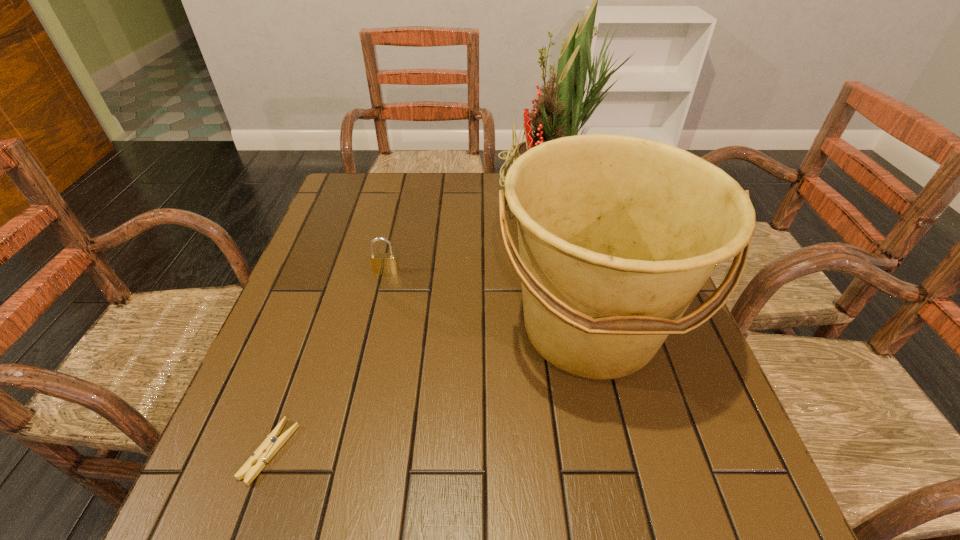
You are a GUI agent. You are given a task and a screenshot of the screen. Output one action in this format:
    pyautogui.click(x=<x>, y=<y>)
    Task: Click on the free region at the far edge of the desktop
    This screenshot has height=540, width=960.
    Given the screenshot: What is the action you would take?
    pyautogui.click(x=397, y=185)

Identify the location of vacant space at the near edge of the desktop. (616, 517).

Locate an element on the screen. vacant space at the left edge is located at coordinates (311, 349).

At what (x,y) coordinates should I click in order to perform the action: click on vacant space at the far left corner of the desktop. Please return your answer as a coordinate pair (x, y). Looking at the image, I should click on (360, 173).

The width and height of the screenshot is (960, 540). In order to click on vacant area that lies between the bucket and the padlock in this screenshot , I will do `click(488, 300)`.

This screenshot has height=540, width=960. In order to click on vacant area that lies between the shortest object and the bucket in this screenshot , I will do `click(430, 390)`.

Where is `vacant region between the shortest object and the farthest object`? vacant region between the shortest object and the farthest object is located at coordinates (411, 325).

Where is `vacant space in between the second shortest object and the third shortest object`? Image resolution: width=960 pixels, height=540 pixels. vacant space in between the second shortest object and the third shortest object is located at coordinates (488, 300).

I want to click on vacant area between the bucket and the clothespin, so [x=430, y=390].

Locate an element on the screen. The width and height of the screenshot is (960, 540). blank region between the second tallest object and the leftmost object is located at coordinates (430, 390).